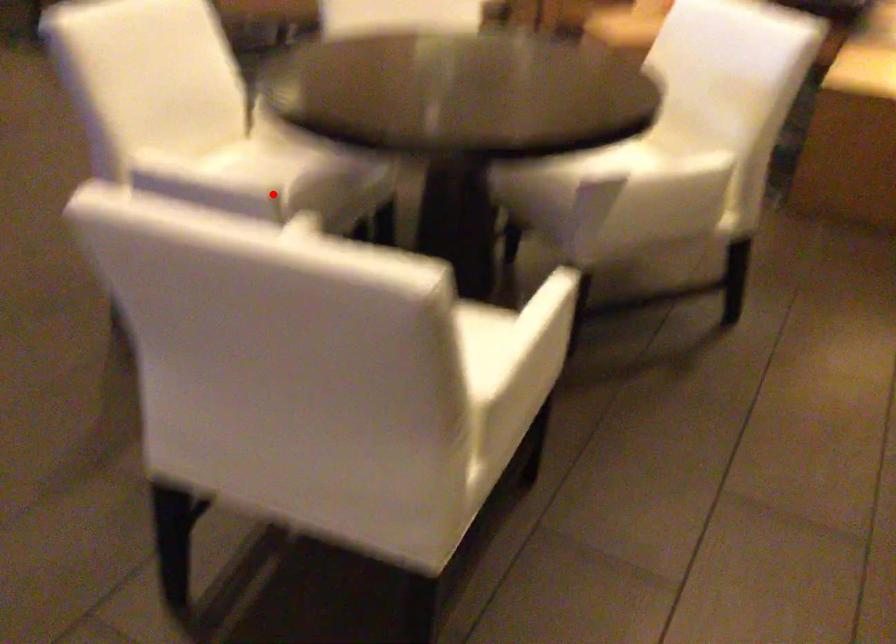
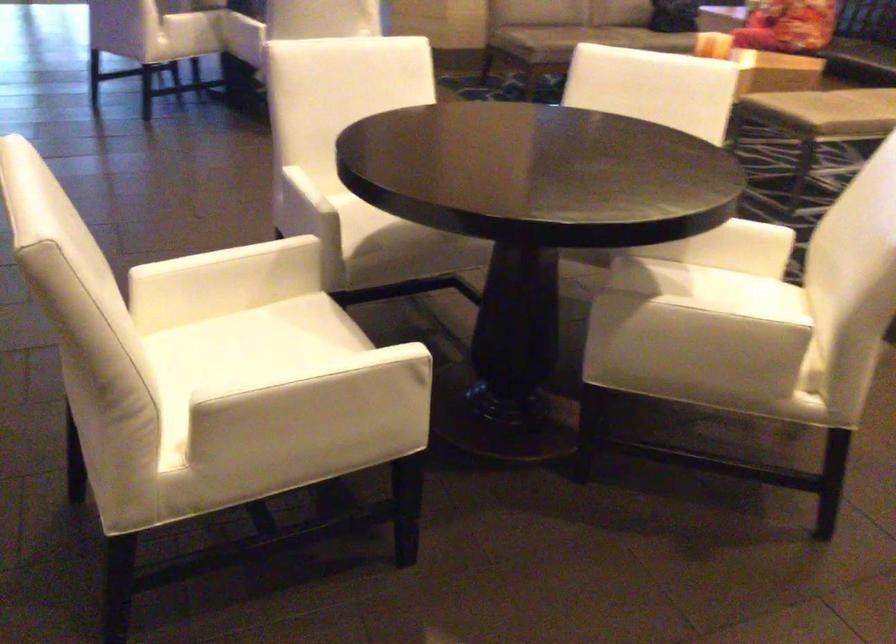
Question: I am providing you with two images of the same scene from different viewpoints. In image1, a red point is highlighted. Considering the same 3D point in image2, which of the following is correct?

Choices:
 (A) It is closer
 (B) It is farther

Answer: (B)